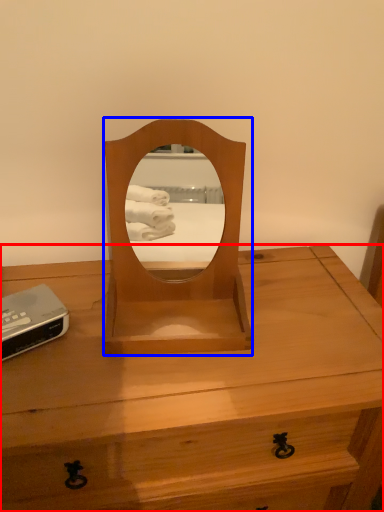
Question: Which object is closer to the camera taking this photo, desk (highlighted by a red box) or mirror (highlighted by a blue box)?

Choices:
 (A) desk
 (B) mirror

Answer: (A)